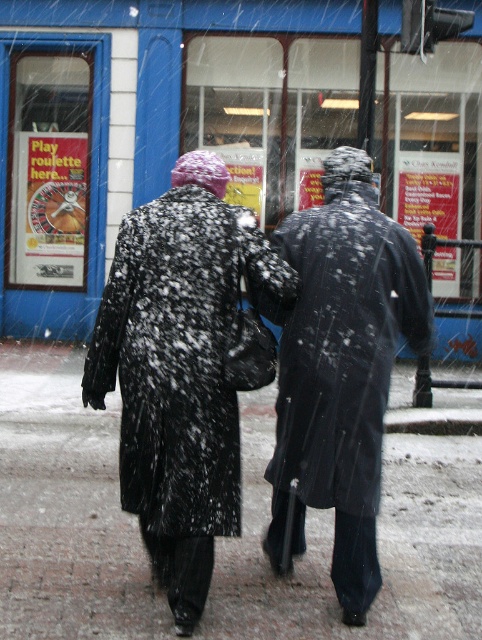
Measure the distance between blue glass window at center and camera.

blue glass window at center and camera are 35.88 feet apart.

Is point (81, 307) behind point (211, 618)?

Yes, it is.

This screenshot has height=640, width=482. I want to click on blue glass window at center, so click(x=156, y=124).

This screenshot has width=482, height=640. I want to click on blue glass window at center, so click(156, 124).

What do you see at coordinates (186, 365) in the screenshot?
I see `snow-covered coat at center` at bounding box center [186, 365].

Can you confirm if snow-covered coat at center is positioned to the right of black matte coat at center?

No, snow-covered coat at center is not to the right of black matte coat at center.

Find the location of a particular element. Image resolution: width=482 pixels, height=640 pixels. snow-covered coat at center is located at coordinates (186, 365).

Is blue glass window at center above black matte coat at center?

Indeed, blue glass window at center is positioned over black matte coat at center.

Is blue glass window at center positioned before black matte coat at center?

No.

Between point (469, 116) and point (323, 401), which one is positioned behind?

Point (469, 116)

Find the location of `blue glass window at center`. blue glass window at center is located at coordinates (x=156, y=124).